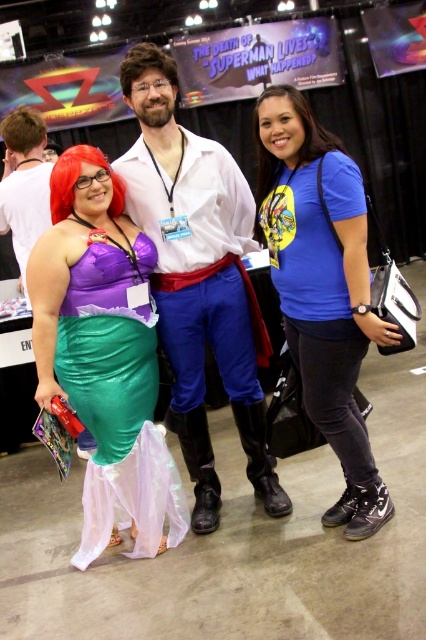
Is point (83, 234) behind point (36, 211)?

That is False.

Is shiny green fabric dress at left shorter than matte black boots at lower center?

No.

Image resolution: width=426 pixels, height=640 pixels. What do you see at coordinates (104, 355) in the screenshot?
I see `shiny green fabric dress at left` at bounding box center [104, 355].

I want to click on shiny green fabric dress at left, so click(x=104, y=355).

Between point (141, 88) and point (19, 246), which one is positioned behind?

The point (19, 246) is behind.

Can you confirm if matte white shirt at center is positioned to the right of matte black boots at lower center?

Correct, you'll find matte white shirt at center to the right of matte black boots at lower center.

Where is `matte white shirt at center`? This screenshot has width=426, height=640. matte white shirt at center is located at coordinates (198, 278).

Is shiny green fabric dress at left positioned behind matte white shirt at center?

No.

Where is `shiny green fabric dress at left`? shiny green fabric dress at left is located at coordinates (104, 355).